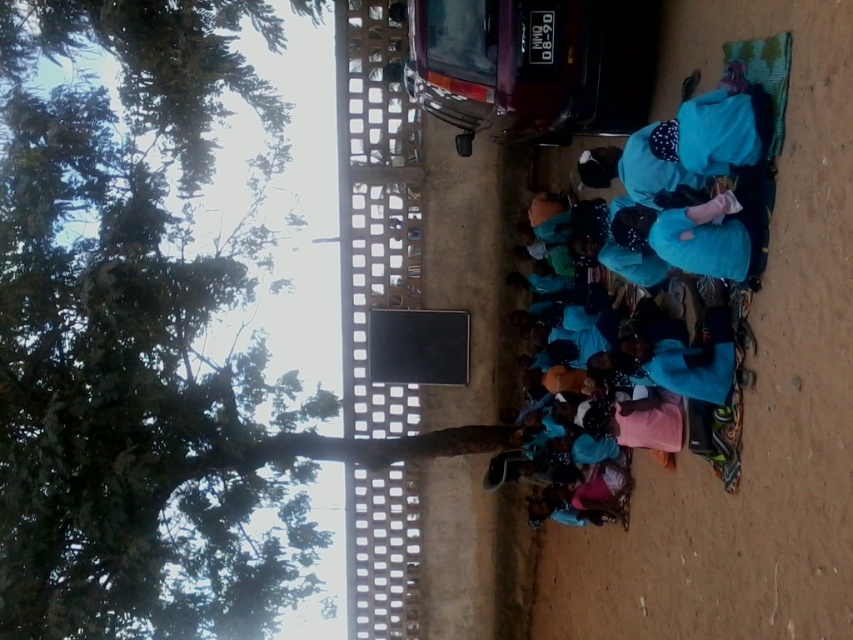
You are planning to set up a small tent between the green leafy tree at upper left and the blue fabric at center. The tent requires a minimum distance of 10 meters between the tree and the fabric to be properly anchored. Can you confirm if the current spacing between them allows for this setup?

The green leafy tree at upper left is 13.57 meters from the blue fabric at center, which exceeds the required 10 meters. Therefore, the tent can be anchored properly between them.

Consider the image. You are standing at the center of the image. There is a point labeled as point (138,337). What object is located at that point?

The point (138,337) indicates a green leafy tree at upper left.

You are standing at the center of the image and want to locate the green leafy tree at upper left. Which direction should you look to find it?

The green leafy tree at upper left is located at point (x=138, y=337), so you should look towards the upper left direction to find it.